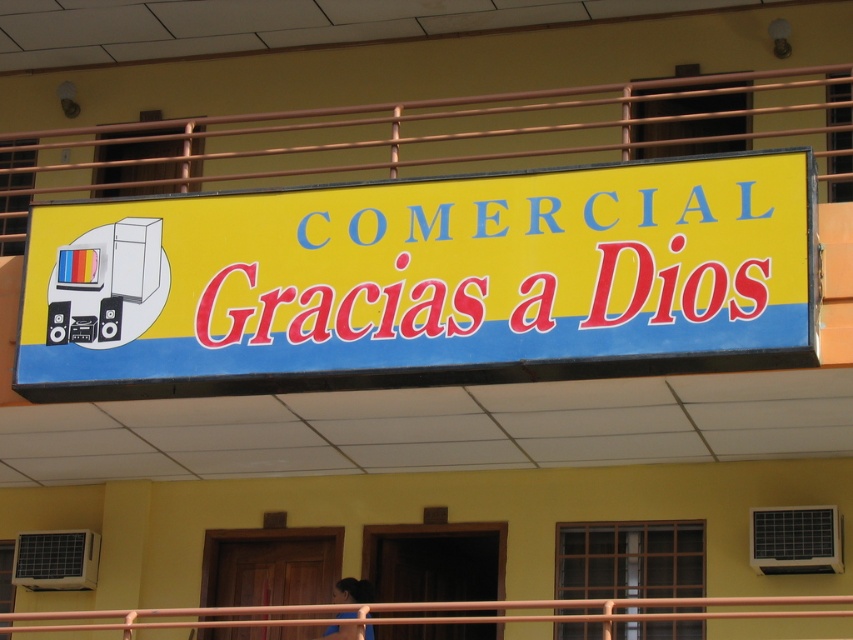
Looking at this image, you are standing in front of the building and want to take a photo of the commercial signboard. You notice two points on the signboard labeled as point (x=811, y=236) and point (x=351, y=580). Which point will appear larger in your camera view?

Point (x=811, y=236) is closer to the camera than point (x=351, y=580), so it will appear larger in the camera view.

You are a delivery person trying to read the text on the yellow matte signboard at center and the dark brown hair at lower center. Which object is closer to you?

The yellow matte signboard at center is closer to you because it is in front of the dark brown hair at lower center.

You are standing in front of the building and notice the yellow matte signboard at center and the brown metal rail at center. Which object is positioned to the left when viewed from the front?

The yellow matte signboard at center is positioned to the left of the brown metal rail at center when viewed from the front.